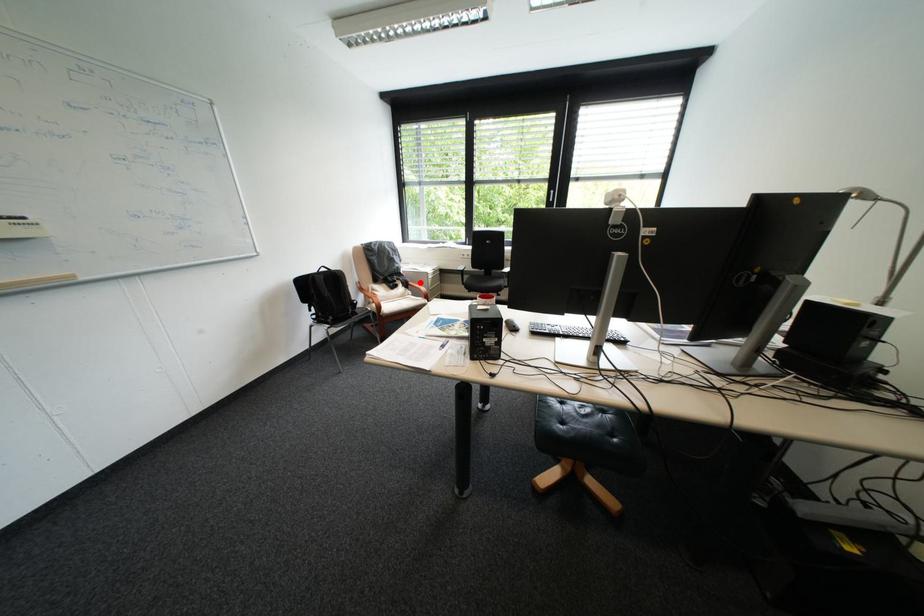
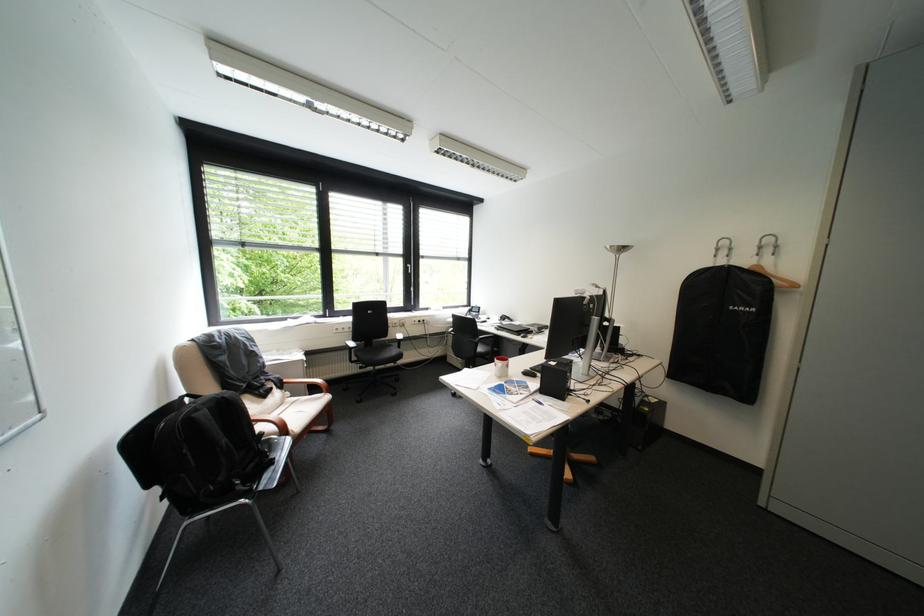
Question: I am providing you with two images of the same scene from different viewpoints. A red point is shown in image1. For the corresponding object point in image2, is it positioned nearer or farther from the camera?

Choices:
 (A) Nearer
 (B) Farther

Answer: (A)